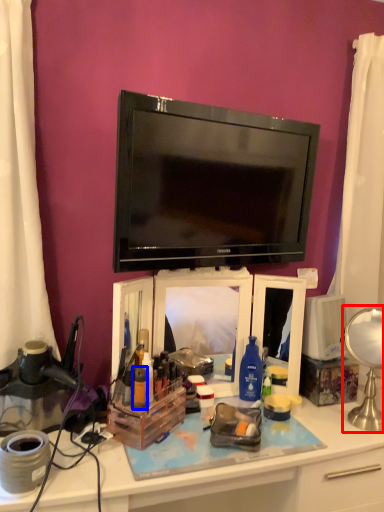
Question: Among these objects, which one is nearest to the camera, table lamp (highlighted by a red box) or toiletry (highlighted by a blue box)?

Choices:
 (A) table lamp
 (B) toiletry

Answer: (B)